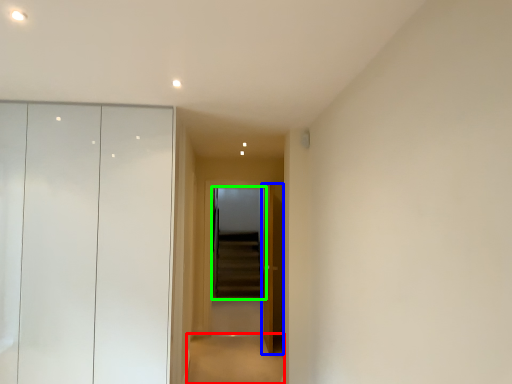
Question: Which object is positioned closest to path (highlighted by a red box)? Select from door (highlighted by a blue box) and screen door (highlighted by a green box).

Choices:
 (A) door
 (B) screen door

Answer: (A)